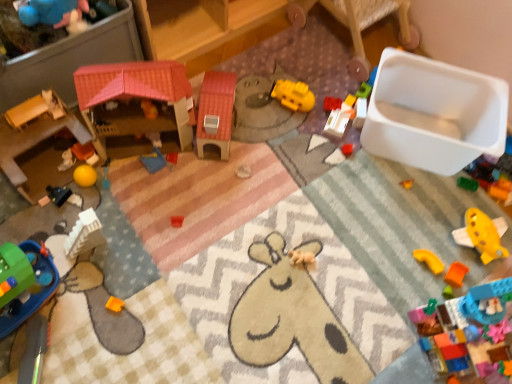
The width and height of the screenshot is (512, 384). Find the location of `empty space that is in between orange matte block at lower right, acting as the 14th toy starting from the left, and white plastic container at center, acting as the 10th toy starting from the left`. empty space that is in between orange matte block at lower right, acting as the 14th toy starting from the left, and white plastic container at center, acting as the 10th toy starting from the left is located at coordinates [x=389, y=197].